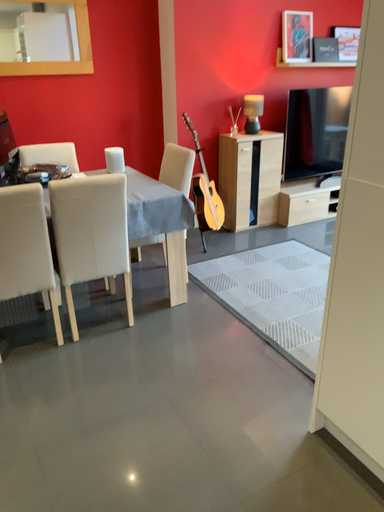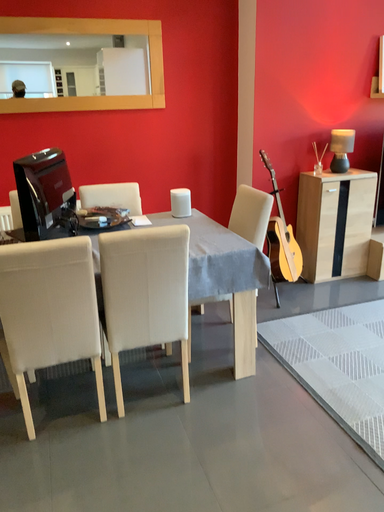
Question: Which way did the camera rotate in the video?

Choices:
 (A) rotated right
 (B) rotated left

Answer: (B)